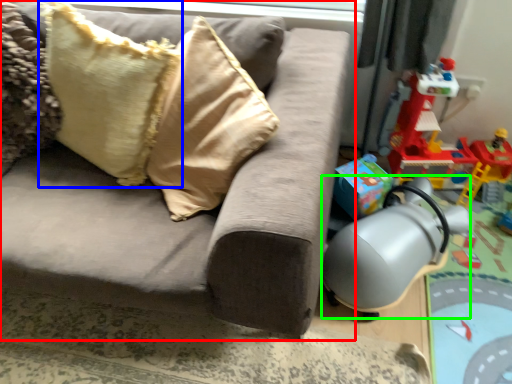
Question: Which object is the closest to the studio couch (highlighted by a red box)? Choose among these: pillow (highlighted by a blue box) or swivel chair (highlighted by a green box).

Choices:
 (A) pillow
 (B) swivel chair

Answer: (A)